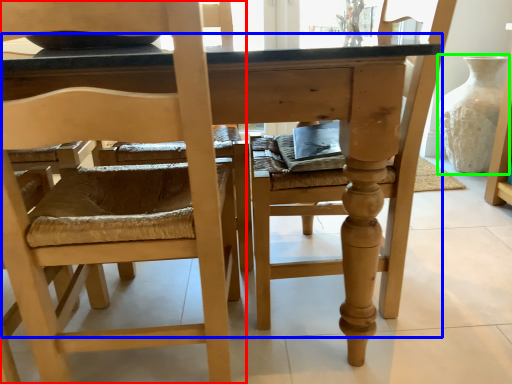
Question: Based on their relative distances, which object is farther from chair (highlighted by a red box)? Choose from table (highlighted by a blue box) and glass vase (highlighted by a green box).

Choices:
 (A) table
 (B) glass vase

Answer: (B)